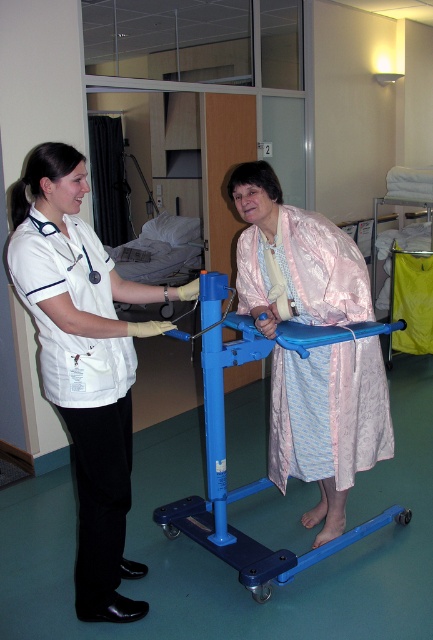
Which is in front, point (310, 260) or point (248, 552)?

Point (310, 260) is in front.

Is point (361, 442) in front of point (204, 502)?

Yes.

Image resolution: width=433 pixels, height=640 pixels. Describe the element at coordinates (329, 422) in the screenshot. I see `pink satin robe at center` at that location.

Identify the location of pink satin robe at center. The height and width of the screenshot is (640, 433). (329, 422).

Is point (87, 403) farther from viewer compared to point (336, 280)?

No, it is in front of (336, 280).

Find the location of a particular element. white smooth uniform at left is located at coordinates (84, 362).

This screenshot has width=433, height=640. I want to click on white smooth uniform at left, so click(84, 362).

You are a GUI agent. You are given a task and a screenshot of the screen. Output one action in this format:
    pyautogui.click(x=<x>, y=<y>)
    Task: Click on the white smooth uniform at left
    The image size is (433, 640).
    Given the screenshot: What is the action you would take?
    pyautogui.click(x=84, y=362)

Does white smooth uniform at left appear on the right side of blue plastic walker at center?

Incorrect, white smooth uniform at left is not on the right side of blue plastic walker at center.

Which is behind, point (89, 300) or point (288, 563)?

Positioned behind is point (288, 563).

Locate an element on the screen. This screenshot has height=640, width=433. white smooth uniform at left is located at coordinates (84, 362).